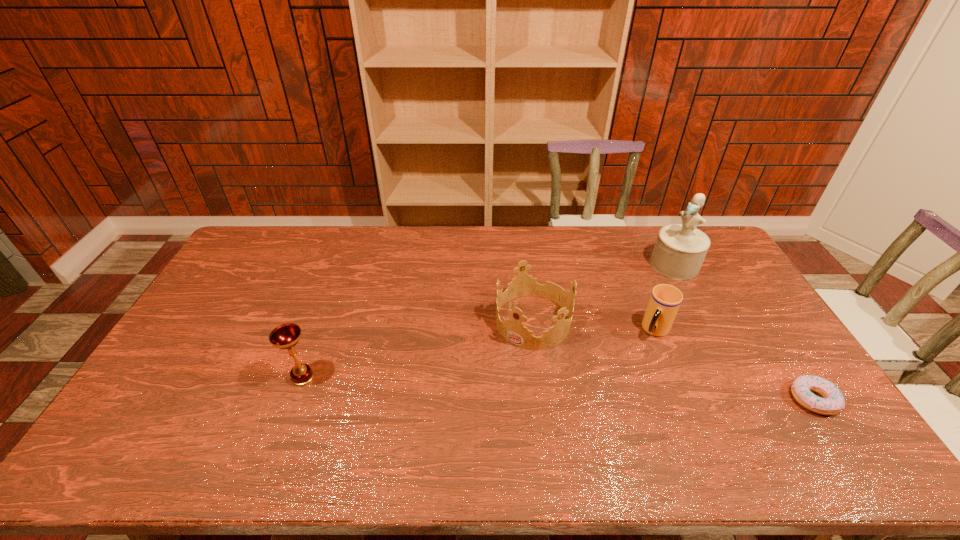
Where is `vacant area that lies between the farthest object and the rightmost object`? vacant area that lies between the farthest object and the rightmost object is located at coordinates (744, 332).

Locate an element on the screen. The height and width of the screenshot is (540, 960). empty location between the cup and the chalice is located at coordinates pos(479,354).

What are the coordinates of `free spot between the second object from right to left and the doughnut` in the screenshot? It's located at (744, 332).

Identify the location of free spot between the shortest object and the cup. (734, 364).

Find the location of `free space between the shortest object and the second object from right to left`. free space between the shortest object and the second object from right to left is located at coordinates (744, 332).

The width and height of the screenshot is (960, 540). I want to click on vacant region between the second object from left to right and the shortest object, so click(x=673, y=360).

Find the location of a particular element. This screenshot has width=960, height=540. empty space that is in between the chalice and the shortest object is located at coordinates click(558, 388).

This screenshot has height=540, width=960. In order to click on unoccupied area between the fourth object from right to left and the chalice in this screenshot , I will do `click(418, 349)`.

Locate an element on the screen. Image resolution: width=960 pixels, height=540 pixels. vacant area between the third object from right to left and the chalice is located at coordinates (479, 354).

Locate an element on the screen. free area in between the chalice and the cup is located at coordinates (479, 354).